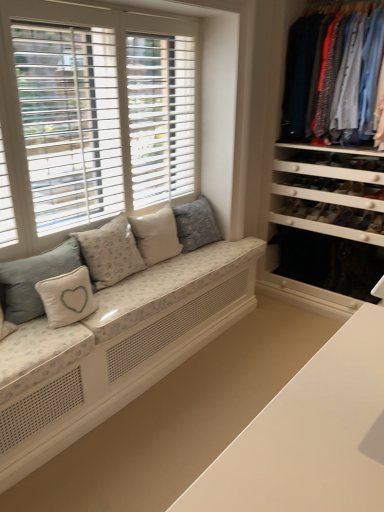
You are a GUI agent. You are given a task and a screenshot of the screen. Output one action in this format:
    pyautogui.click(x=<x>, y=<y>)
    Task: Click on the light beige fabric couch at lower left
    
    Given the screenshot: What is the action you would take?
    pyautogui.click(x=111, y=337)

What is the approximate height of white wood window at left?

white wood window at left is 1.23 meters in height.

Image resolution: width=384 pixels, height=512 pixels. Find the location of `white fabric pillow with heart design at left, placed as the 2th pillow when sorted from left to right`. white fabric pillow with heart design at left, placed as the 2th pillow when sorted from left to right is located at coordinates tap(67, 297).

I want to click on floral fabric cushion at center, which appears as the 5th pillow when viewed from the left, so click(196, 224).

Describe the element at coordinates (156, 234) in the screenshot. I see `light beige fabric pillow at center, which ranks as the second pillow in right-to-left order` at that location.

You are a GUI agent. You are given a task and a screenshot of the screen. Output one action in this format:
    pyautogui.click(x=<x>, y=<y>)
    Task: Click on the light beige fabric couch at lower left
    The height and width of the screenshot is (512, 384).
    Given the screenshot: What is the action you would take?
    pyautogui.click(x=111, y=337)

From the picture: From the image's perspective, is light beige fabric pillow with heart design at center-left, which appears as the 3th pillow when viewed from the right, located above white fabric pillow with heart design at left, placed as the 2th pillow when sorted from left to right?

Yes.

From a real-world perspective, relative to white fabric pillow with heart design at left, placed as the 2th pillow when sorted from left to right, is light beige fabric pillow with heart design at center-left, which appears as the 3th pillow when viewed from the right, vertically above or below?

light beige fabric pillow with heart design at center-left, which appears as the 3th pillow when viewed from the right, is situated higher than white fabric pillow with heart design at left, placed as the 2th pillow when sorted from left to right, in the real world.

Is light beige fabric pillow with heart design at center-left, which appears as the 3th pillow when viewed from the right, inside the boundaries of white fabric pillow with heart design at left, placed as the 2th pillow when sorted from left to right, or outside?

light beige fabric pillow with heart design at center-left, which appears as the 3th pillow when viewed from the right, is outside white fabric pillow with heart design at left, placed as the 2th pillow when sorted from left to right.

Does light beige fabric pillow with heart design at center-left, the 3th pillow when ordered from left to right, have a smaller size compared to white fabric pillow with heart design at left, placed as the 2th pillow when sorted from left to right?

Actually, light beige fabric pillow with heart design at center-left, the 3th pillow when ordered from left to right, might be larger than white fabric pillow with heart design at left, placed as the 2th pillow when sorted from left to right.

From the image's perspective, between light blue fabric pillow with heart design at lower left, which ranks as the fifth pillow in right-to-left order, and white wood window at left, which one is located above?

From the image's view, white wood window at left is above.

Considering the sizes of objects light blue fabric pillow with heart design at lower left, the first pillow when ordered from left to right, and white wood window at left in the image provided, who is taller, light blue fabric pillow with heart design at lower left, the first pillow when ordered from left to right, or white wood window at left?

Standing taller between the two is white wood window at left.

Which of these two, light blue fabric pillow with heart design at lower left, the first pillow when ordered from left to right, or white wood window at left, is bigger?

Bigger between the two is white wood window at left.

Is light blue fabric pillow with heart design at lower left, the first pillow when ordered from left to right, directly adjacent to white wood window at left?

No.

Considering the sizes of objects light blue fabric pillow with heart design at lower left, which ranks as the fifth pillow in right-to-left order, and light beige fabric couch at lower left in the image provided, who is taller, light blue fabric pillow with heart design at lower left, which ranks as the fifth pillow in right-to-left order, or light beige fabric couch at lower left?

Standing taller between the two is light blue fabric pillow with heart design at lower left, which ranks as the fifth pillow in right-to-left order.

Is light blue fabric pillow with heart design at lower left, the first pillow when ordered from left to right, thinner than light beige fabric couch at lower left?

Correct, the width of light blue fabric pillow with heart design at lower left, the first pillow when ordered from left to right, is less than that of light beige fabric couch at lower left.

Which is in front, point (1, 263) or point (105, 372)?

The point (1, 263) is more forward.

From a real-world perspective, is light blue fabric pillow with heart design at lower left, the first pillow when ordered from left to right, positioned above or below light beige fabric couch at lower left?

In terms of real-world spatial position, light blue fabric pillow with heart design at lower left, the first pillow when ordered from left to right, is above light beige fabric couch at lower left.

From the image's perspective, is light blue fabric pillow with heart design at lower left, which ranks as the fifth pillow in right-to-left order, under light blue cotton shirts at right?

Correct, light blue fabric pillow with heart design at lower left, which ranks as the fifth pillow in right-to-left order, appears lower than light blue cotton shirts at right in the image.

Looking at the image, does light blue fabric pillow with heart design at lower left, the first pillow when ordered from left to right, seem bigger or smaller compared to light blue cotton shirts at right?

Considering their sizes, light blue fabric pillow with heart design at lower left, the first pillow when ordered from left to right, takes up less space than light blue cotton shirts at right.

Considering the relative positions of light blue fabric pillow with heart design at lower left, the first pillow when ordered from left to right, and light blue cotton shirts at right in the image provided, is light blue fabric pillow with heart design at lower left, the first pillow when ordered from left to right, to the right of light blue cotton shirts at right from the viewer's perspective?

No, light blue fabric pillow with heart design at lower left, the first pillow when ordered from left to right, is not to the right of light blue cotton shirts at right.

Which object is more forward, light blue fabric pillow with heart design at lower left, the first pillow when ordered from left to right, or light blue cotton shirts at right?

Positioned in front is light blue fabric pillow with heart design at lower left, the first pillow when ordered from left to right.

From a real-world perspective, is light beige fabric couch at lower left below floral fabric cushion at center, acting as the first pillow starting from the right?

Indeed, from a real-world perspective, light beige fabric couch at lower left is positioned beneath floral fabric cushion at center, acting as the first pillow starting from the right.

From the image's perspective, is light beige fabric couch at lower left below floral fabric cushion at center, which appears as the 5th pillow when viewed from the left?

Yes, from the image's perspective, light beige fabric couch at lower left is below floral fabric cushion at center, which appears as the 5th pillow when viewed from the left.

Does light beige fabric couch at lower left turn towards floral fabric cushion at center, acting as the first pillow starting from the right?

No, light beige fabric couch at lower left is not oriented towards floral fabric cushion at center, acting as the first pillow starting from the right.

Is light beige fabric couch at lower left situated inside floral fabric cushion at center, which appears as the 5th pillow when viewed from the left, or outside?

light beige fabric couch at lower left cannot be found inside floral fabric cushion at center, which appears as the 5th pillow when viewed from the left.

Considering the relative positions of light blue cotton shirts at right and floral fabric cushion at center, which appears as the 5th pillow when viewed from the left, in the image provided, is light blue cotton shirts at right to the left of floral fabric cushion at center, which appears as the 5th pillow when viewed from the left, from the viewer's perspective?

No.

Is light blue cotton shirts at right positioned with its back to floral fabric cushion at center, which appears as the 5th pillow when viewed from the left?

No, light blue cotton shirts at right is not facing the opposite direction of floral fabric cushion at center, which appears as the 5th pillow when viewed from the left.

Which of these two, light blue cotton shirts at right or floral fabric cushion at center, acting as the first pillow starting from the right, is thinner?

Thinner between the two is floral fabric cushion at center, acting as the first pillow starting from the right.

From their relative heights in the image, would you say light blue cotton shirts at right is taller or shorter than floral fabric cushion at center, acting as the first pillow starting from the right?

In the image, light blue cotton shirts at right appears to be taller than floral fabric cushion at center, acting as the first pillow starting from the right.

Which object is positioned more to the right, light beige fabric couch at lower left or light blue cotton shirts at right?

light blue cotton shirts at right.

Relative to light blue cotton shirts at right, is light beige fabric couch at lower left in front or behind?

light beige fabric couch at lower left is in front of light blue cotton shirts at right.

What's the angular difference between light beige fabric couch at lower left and light blue cotton shirts at right's facing directions?

light beige fabric couch at lower left and light blue cotton shirts at right are facing 89.1 degrees away from each other.

Consider the image. How far apart are light beige fabric couch at lower left and light blue cotton shirts at right?

light beige fabric couch at lower left and light blue cotton shirts at right are 1.50 meters apart from each other.

I want to click on the 2nd pillow below when counting from the light beige fabric pillow with heart design at center-left, which appears as the 3th pillow when viewed from the right (from the image's perspective), so click(x=67, y=297).

What are the coordinates of `window on the right of the light blue fabric pillow with heart design at lower left, the first pillow when ordered from left to right` in the screenshot? It's located at (92, 118).

Estimate the real-world distances between objects in this image. Which object is further from light beige fabric couch at lower left, white fabric pillow with heart design at left, placed as the 2th pillow when sorted from left to right, or white wood window at left?

Based on the image, white wood window at left appears to be further to light beige fabric couch at lower left.

When comparing their distances from light blue cotton shirts at right, does light beige fabric couch at lower left or floral fabric cushion at center, acting as the first pillow starting from the right, seem closer?

Based on the image, floral fabric cushion at center, acting as the first pillow starting from the right, appears to be nearer to light blue cotton shirts at right.

Estimate the real-world distances between objects in this image. Which object is closer to white wood window at left, light beige fabric couch at lower left or light blue cotton shirts at right?

Among the two, light beige fabric couch at lower left is located nearer to white wood window at left.

Considering their positions, is light blue cotton shirts at right positioned closer to white wood window at left than light beige fabric couch at lower left?

Among the two, light beige fabric couch at lower left is located nearer to white wood window at left.

From the image, which object appears to be farther from light beige fabric pillow at center, which ranks as the second pillow in right-to-left order, light beige fabric pillow with heart design at center-left, the 3th pillow when ordered from left to right, or floral fabric cushion at center, acting as the first pillow starting from the right?

The object further to light beige fabric pillow at center, which ranks as the second pillow in right-to-left order, is floral fabric cushion at center, acting as the first pillow starting from the right.

From the picture: Based on their spatial positions, is light blue cotton shirts at right or white fabric pillow with heart design at left, placed as the 2th pillow when sorted from left to right, further from light beige fabric pillow with heart design at center-left, which appears as the 3th pillow when viewed from the right?

light blue cotton shirts at right is positioned further to the anchor light beige fabric pillow with heart design at center-left, which appears as the 3th pillow when viewed from the right.

Looking at the image, which one is located closer to white wood window at left, light beige fabric pillow with heart design at center-left, which appears as the 3th pillow when viewed from the right, or white fabric pillow with heart design at left, placed as the 2th pillow when sorted from left to right?

light beige fabric pillow with heart design at center-left, which appears as the 3th pillow when viewed from the right, is positioned closer to the anchor white wood window at left.

Which object lies nearer to the anchor point light beige fabric pillow with heart design at center-left, which appears as the 3th pillow when viewed from the right, light blue fabric pillow with heart design at lower left, the first pillow when ordered from left to right, or floral fabric cushion at center, acting as the first pillow starting from the right?

The object closer to light beige fabric pillow with heart design at center-left, which appears as the 3th pillow when viewed from the right, is light blue fabric pillow with heart design at lower left, the first pillow when ordered from left to right.

Identify the location of window between light blue fabric pillow with heart design at lower left, which ranks as the fifth pillow in right-to-left order, and light blue cotton shirts at right from left to right. (92, 118).

The width and height of the screenshot is (384, 512). Find the location of `window between light beige fabric pillow with heart design at center-left, which appears as the 3th pillow when viewed from the right, and light blue cotton shirts at right, in the horizontal direction`. window between light beige fabric pillow with heart design at center-left, which appears as the 3th pillow when viewed from the right, and light blue cotton shirts at right, in the horizontal direction is located at coordinates (92, 118).

The height and width of the screenshot is (512, 384). In order to click on window between white fabric pillow with heart design at left, placed as the 2th pillow when sorted from left to right, and light blue cotton shirts at right, in the horizontal direction in this screenshot , I will do point(92,118).

What are the coordinates of `pillow positioned between light beige fabric pillow with heart design at center-left, which appears as the 3th pillow when viewed from the right, and floral fabric cushion at center, which appears as the 5th pillow when viewed from the left, from near to far` in the screenshot? It's located at (156, 234).